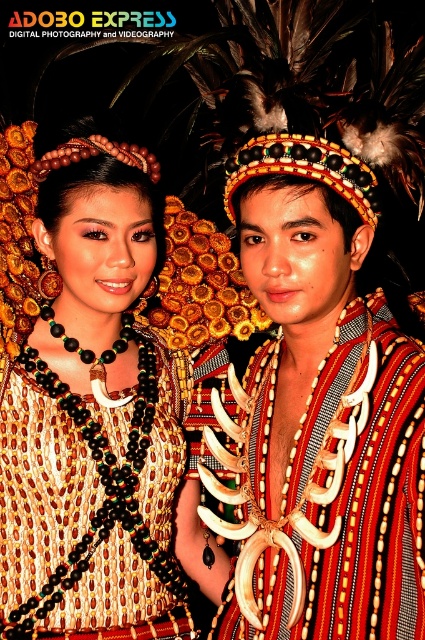
You are a photographer trying to capture both necklaces in a single frame. Given that the black beaded necklace at center and the shiny gold necklace at center are both centered, which necklace would appear larger in the photo?

The shiny gold necklace at center would appear larger in the photo because it is larger than the black beaded necklace at center.

You are an anthropologist examining the image of two people in traditional attire. You notice both the black beaded necklace at center and the shiny gold necklace at center. Which necklace is located to the left of the other?

The black beaded necklace at center is positioned on the left side of the shiny gold necklace at center.

You are a photographer standing at the scene. You want to capture a closeup shot of the black beaded necklace at center. What is the minimum distance you need to move forward to ensure the necklace fills the frame properly?

The minimum distance you need to move forward is 1.13 meters to ensure the black beaded necklace at center fills the frame properly.